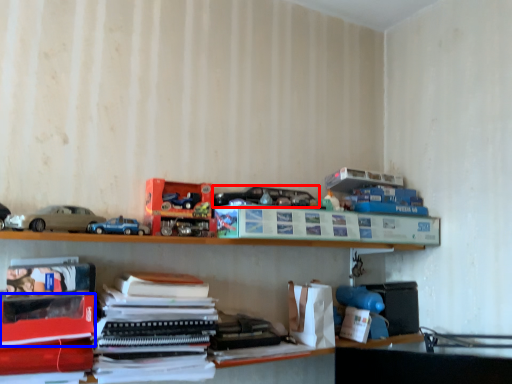
Question: Which object is closer to the camera taking this photo, toy (highlighted by a red box) or paperback book (highlighted by a blue box)?

Choices:
 (A) toy
 (B) paperback book

Answer: (B)